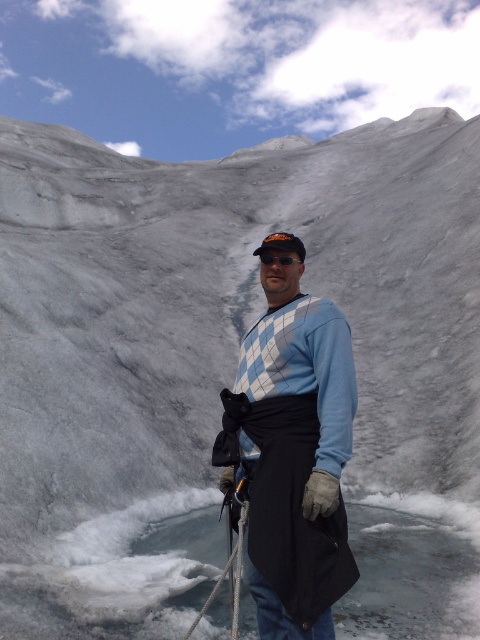
Between white nylon rope at center and transparent plastic goggles at center, which one has less height?

With less height is transparent plastic goggles at center.

Does white nylon rope at center have a lesser height compared to transparent plastic goggles at center?

Incorrect, white nylon rope at center's height does not fall short of transparent plastic goggles at center's.

Based on the photo, who is more forward, (230,557) or (273,252)?

Point (230,557) is in front.

This screenshot has width=480, height=640. I want to click on white nylon rope at center, so click(228, 573).

Is blue argyle sweater at center thinner than white nylon rope at center?

No, blue argyle sweater at center is not thinner than white nylon rope at center.

Can you confirm if blue argyle sweater at center is positioned to the right of white nylon rope at center?

Indeed, blue argyle sweater at center is positioned on the right side of white nylon rope at center.

Which is behind, point (288, 353) or point (235, 497)?

The point (235, 497) is behind.

You are a GUI agent. You are given a task and a screenshot of the screen. Output one action in this format:
    pyautogui.click(x=<x>, y=<y>)
    Task: Click on the blue argyle sweater at center
    This screenshot has width=480, height=640.
    Given the screenshot: What is the action you would take?
    pyautogui.click(x=294, y=456)

Which is in front, point (328, 499) or point (292, 252)?

Positioned in front is point (328, 499).

Which is more to the right, blue argyle sweater at center or transparent plastic goggles at center?

Positioned to the right is transparent plastic goggles at center.

Find the location of `blue argyle sweater at center`. blue argyle sweater at center is located at coordinates (294, 456).

Find the location of a particular element. blue argyle sweater at center is located at coordinates (294, 456).